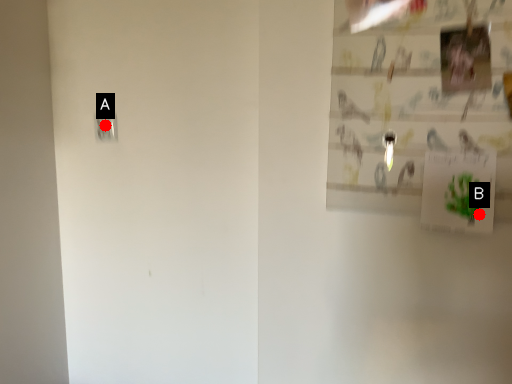
Question: Two points are circled on the image, labeled by A and B beside each circle. Which of the following is the farthest from the observer?

Choices:
 (A) A is further
 (B) B is further

Answer: (A)